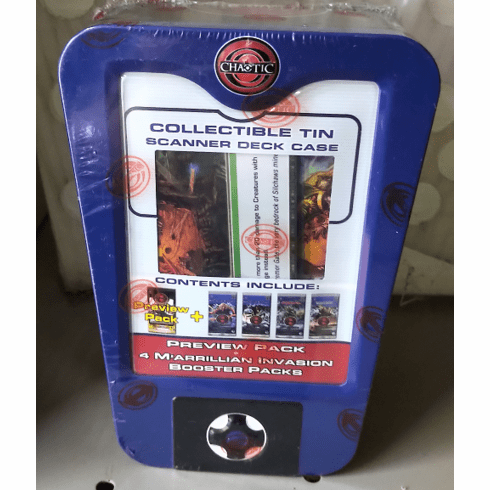
Locate an element on the screen. This screenshot has height=490, width=490. blue frame is located at coordinates (112, 43).